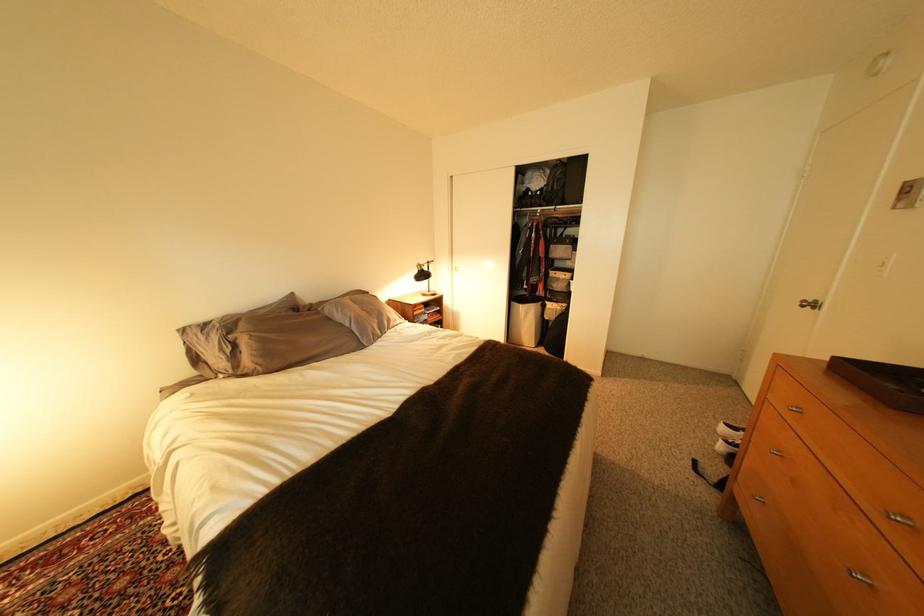
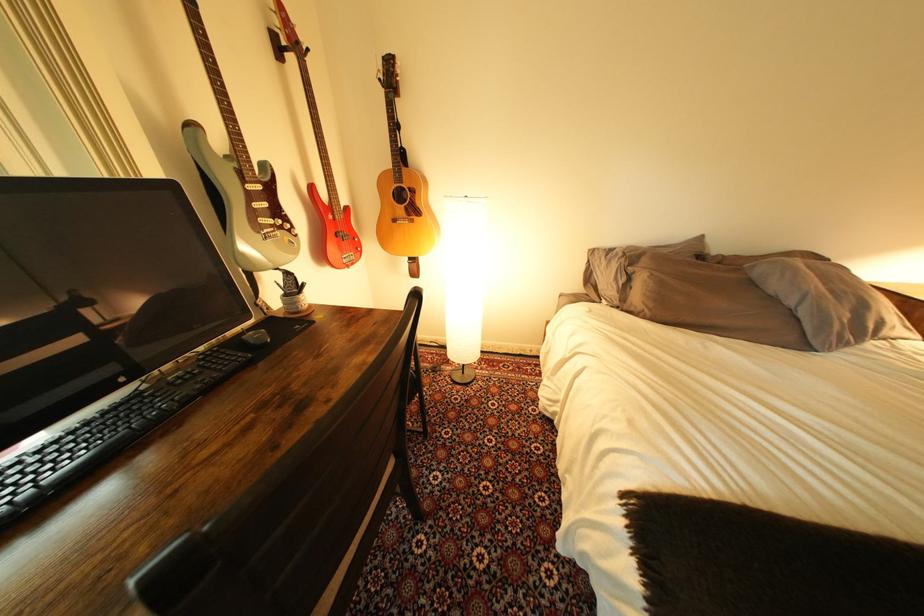
The point at [196,331] is marked in the first image. Where is the corresponding point in the second image?

(604, 253)